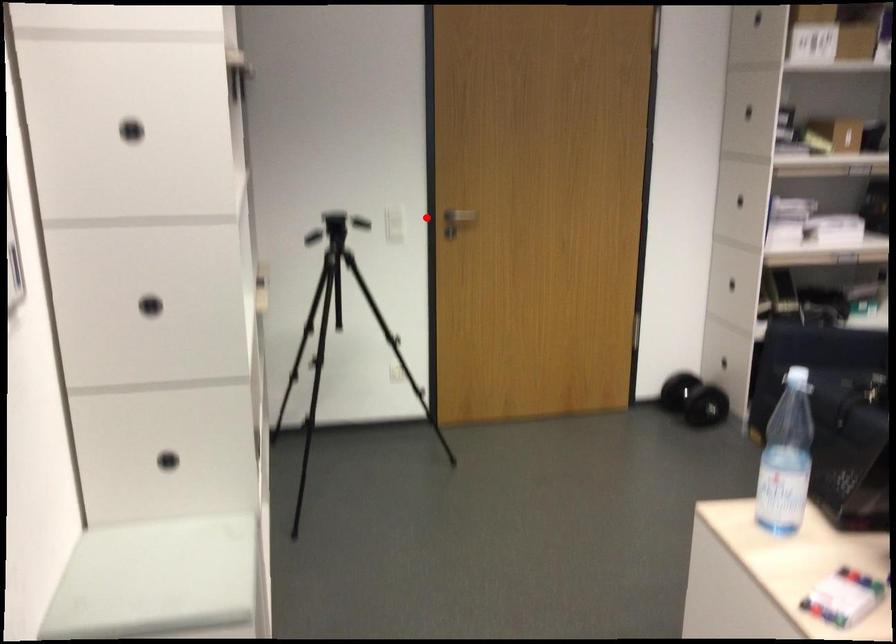
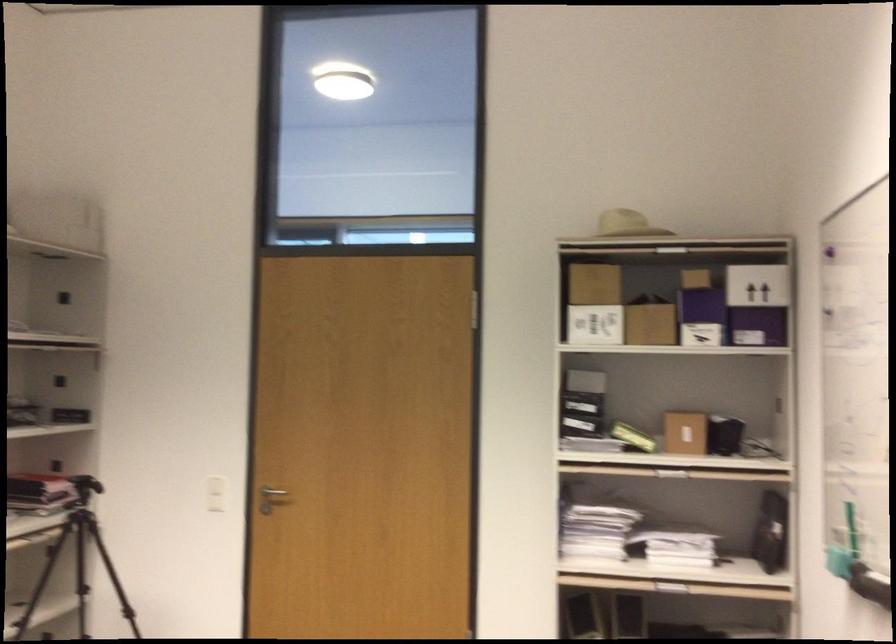
Question: I am providing you with two images of the same scene from different viewpoints. A red point is marked on the first image. At the location where the point appears in image 1, is it still visible in image 2?

Choices:
 (A) Yes
 (B) No

Answer: (A)